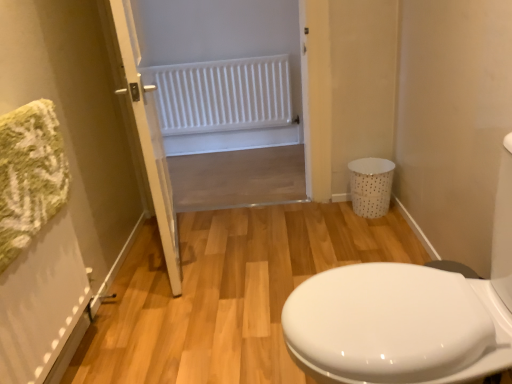
Describe the element at coordinates (142, 131) in the screenshot. Image resolution: width=512 pixels, height=384 pixels. I see `white wooden door at center` at that location.

What do you see at coordinates (408, 315) in the screenshot?
I see `white glossy porcelain at right` at bounding box center [408, 315].

Locate an element on the screen. Image resolution: width=512 pixels, height=384 pixels. white matte radiator at upper center is located at coordinates (222, 95).

The height and width of the screenshot is (384, 512). I want to click on white wooden door at center, so click(142, 131).

From the picture: Is white glossy porcelain at right positioned far away from white dotted plastic laundry basket at right?

Indeed, white glossy porcelain at right is not near white dotted plastic laundry basket at right.

Is white glossy porcelain at right completely or partially outside of white dotted plastic laundry basket at right?

That's correct, white glossy porcelain at right is outside of white dotted plastic laundry basket at right.

From a real-world perspective, who is located lower, white glossy porcelain at right or white dotted plastic laundry basket at right?

white dotted plastic laundry basket at right, from a real-world perspective.

From the image's perspective, is white glossy porcelain at right below white dotted plastic laundry basket at right?

Yes, from the image's perspective, white glossy porcelain at right is beneath white dotted plastic laundry basket at right.

Considering the relative sizes of white wooden door at center and white plastic radiator at upper center in the image provided, is white wooden door at center bigger than white plastic radiator at upper center?

Actually, white wooden door at center might be smaller than white plastic radiator at upper center.

How much distance is there between white wooden door at center and white plastic radiator at upper center?

92.45 centimeters.

The height and width of the screenshot is (384, 512). In the image, there is a white plastic radiator at upper center. Find the location of `door below it (from the image's perspective)`. door below it (from the image's perspective) is located at coordinates (142, 131).

From the image's perspective, is white wooden door at center positioned above or below white plastic radiator at upper center?

Clearly, from the image's perspective, white wooden door at center is below white plastic radiator at upper center.

Considering the positions of objects white matte radiator at upper center and white wooden door at center in the image provided, who is behind, white matte radiator at upper center or white wooden door at center?

white matte radiator at upper center.

From a real-world perspective, which object stands above the other?

In real-world perspective, white wooden door at center is above.

Between white matte radiator at upper center and white wooden door at center, which one has more height?

With more height is white wooden door at center.

Considering the positions of objects white matte radiator at upper center and white wooden door at center in the image provided, who is more to the left, white matte radiator at upper center or white wooden door at center?

white wooden door at center is more to the left.

Measure the distance between white wooden door at center and white matte radiator at upper center.

The distance of white wooden door at center from white matte radiator at upper center is 1.34 meters.

From the picture: Is white matte radiator at upper center surrounded by white wooden door at center?

Definitely not — white matte radiator at upper center is not inside white wooden door at center.

Is white wooden door at center not close to white matte radiator at upper center?

Yes.

Where is `door that is below the white matte radiator at upper center (from the image's perspective)`? door that is below the white matte radiator at upper center (from the image's perspective) is located at coordinates (142, 131).

Locate an element on the screen. The image size is (512, 384). door above the white glossy porcelain at right (from a real-world perspective) is located at coordinates (142, 131).

How much distance is there between white wooden door at center and white glossy porcelain at right?

A distance of 1.01 meters exists between white wooden door at center and white glossy porcelain at right.

Consider the image. Is white wooden door at center smaller than white glossy porcelain at right?

Yes, white wooden door at center is smaller than white glossy porcelain at right.

Is white wooden door at center oriented towards white glossy porcelain at right?

No, white wooden door at center is not oriented towards white glossy porcelain at right.

From a real-world perspective, is white glossy porcelain at right positioned above or below white plastic radiator at upper center?

white glossy porcelain at right is situated lower than white plastic radiator at upper center in the real world.

Do you think white glossy porcelain at right is within white plastic radiator at upper center, or outside of it?

white glossy porcelain at right cannot be found inside white plastic radiator at upper center.

Is white glossy porcelain at right further to the viewer compared to white plastic radiator at upper center?

No.

Does white glossy porcelain at right have a smaller size compared to white plastic radiator at upper center?

Actually, white glossy porcelain at right might be larger than white plastic radiator at upper center.

Between white plastic radiator at upper center and white wooden door at center, which one has larger size?

With larger size is white plastic radiator at upper center.

Considering the positions of point (238, 164) and point (161, 188), is point (238, 164) closer or farther from the camera than point (161, 188)?

Clearly, point (238, 164) is more distant from the camera than point (161, 188).

Can you see white plastic radiator at upper center touching white wooden door at center?

white plastic radiator at upper center is not next to white wooden door at center, and they're not touching.

Would you say white wooden door at center is part of white plastic radiator at upper center's contents?

No, white wooden door at center is not surrounded by white plastic radiator at upper center.

I want to click on porcelain located above the white dotted plastic laundry basket at right (from a real-world perspective), so click(x=408, y=315).

Find the location of a particular element. The image size is (512, 384). screen door above the white wooden door at center (from the image's perspective) is located at coordinates (214, 105).

Which object lies further to the anchor point white wooden door at center, white glossy porcelain at right or white dotted plastic laundry basket at right?

Based on the image, white dotted plastic laundry basket at right appears to be further to white wooden door at center.

Based on their spatial positions, is white matte radiator at upper center or white dotted plastic laundry basket at right further from white plastic radiator at upper center?

The object further to white plastic radiator at upper center is white dotted plastic laundry basket at right.

From the picture: Estimate the real-world distances between objects in this image. Which object is closer to white dotted plastic laundry basket at right, white matte radiator at upper center or white glossy porcelain at right?

white glossy porcelain at right is positioned closer to the anchor white dotted plastic laundry basket at right.

Looking at the image, which one is located closer to white wooden door at center, white plastic radiator at upper center or white dotted plastic laundry basket at right?

white plastic radiator at upper center is positioned closer to the anchor white wooden door at center.

Based on their spatial positions, is white dotted plastic laundry basket at right or white matte radiator at upper center further from white wooden door at center?

Among the two, white matte radiator at upper center is located further to white wooden door at center.

From the image, which object appears to be farther from white glossy porcelain at right, white matte radiator at upper center or white wooden door at center?

Among the two, white matte radiator at upper center is located further to white glossy porcelain at right.

Looking at the image, which one is located closer to white dotted plastic laundry basket at right, white glossy porcelain at right or white matte radiator at upper center?

The object closer to white dotted plastic laundry basket at right is white glossy porcelain at right.

When comparing their distances from white plastic radiator at upper center, does white wooden door at center or white matte radiator at upper center seem further?

white wooden door at center lies further to white plastic radiator at upper center than the other object.

What are the coordinates of `screen door between white glossy porcelain at right and white dotted plastic laundry basket at right from front to back` in the screenshot? It's located at (214, 105).

Where is `screen door situated between white wooden door at center and white dotted plastic laundry basket at right from left to right`? screen door situated between white wooden door at center and white dotted plastic laundry basket at right from left to right is located at coordinates (214, 105).

Locate an element on the screen. Image resolution: width=512 pixels, height=384 pixels. door between white glossy porcelain at right and white plastic radiator at upper center from front to back is located at coordinates (142, 131).

Where is `door positioned between white glossy porcelain at right and white dotted plastic laundry basket at right from near to far`? door positioned between white glossy porcelain at right and white dotted plastic laundry basket at right from near to far is located at coordinates (142, 131).